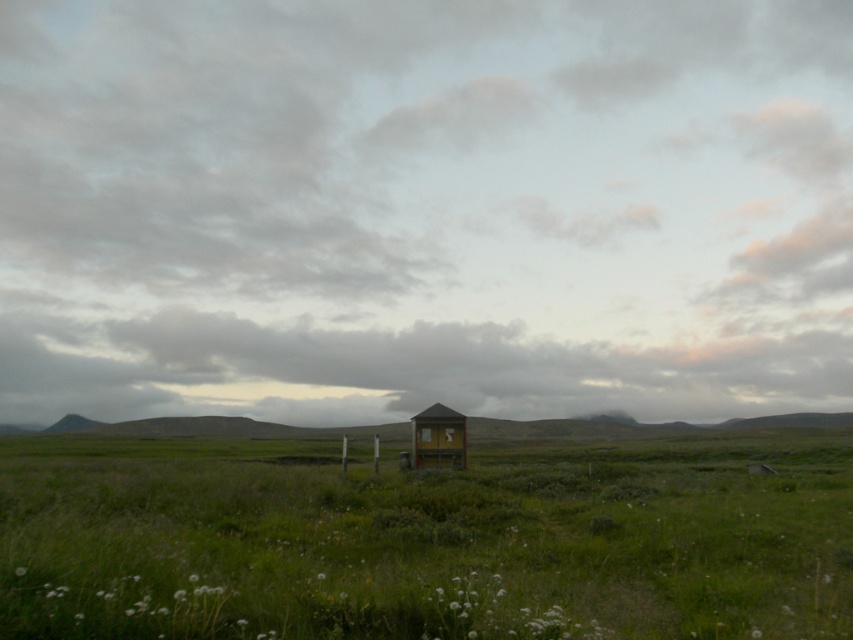
Based on the photo, can you confirm if cloudy sky at upper center is bigger than wooden cabin at center?

Correct, cloudy sky at upper center is larger in size than wooden cabin at center.

Who is more distant from viewer, (791, 92) or (434, 413)?

Point (791, 92)

Is point (321, 45) less distant than point (438, 458)?

No.

You are a GUI agent. You are given a task and a screenshot of the screen. Output one action in this format:
    pyautogui.click(x=<x>, y=<y>)
    Task: Click on the cloudy sky at upper center
    The height and width of the screenshot is (640, 853).
    Given the screenshot: What is the action you would take?
    pyautogui.click(x=424, y=209)

How far apart are cloudy sky at upper center and green grassy field at center?

The distance of cloudy sky at upper center from green grassy field at center is 273.16 feet.

Does point (277, 220) lie in front of point (428, 480)?

No, (277, 220) is behind (428, 480).

Identify the location of cloudy sky at upper center. The width and height of the screenshot is (853, 640). (424, 209).

Is green grassy field at center smaller than wooden cabin at center?

Actually, green grassy field at center might be larger than wooden cabin at center.

Does green grassy field at center come behind wooden cabin at center?

No, green grassy field at center is closer to the viewer.

This screenshot has height=640, width=853. What are the coordinates of `green grassy field at center` in the screenshot? It's located at (424, 540).